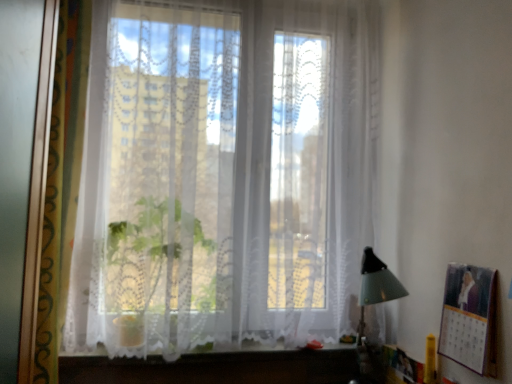
Question: Is metallic silver picture frame at right completely or partially inside transparent lace curtain at center?

Choices:
 (A) no
 (B) yes

Answer: (A)

Question: Is transparent lace curtain at center smaller than metallic silver picture frame at right?

Choices:
 (A) no
 (B) yes

Answer: (A)

Question: Is transparent lace curtain at center thinner than metallic silver picture frame at right?

Choices:
 (A) no
 (B) yes

Answer: (A)

Question: Can you confirm if transparent lace curtain at center is wider than metallic silver picture frame at right?

Choices:
 (A) no
 (B) yes

Answer: (B)

Question: From a real-world perspective, is transparent lace curtain at center positioned over metallic silver picture frame at right based on gravity?

Choices:
 (A) no
 (B) yes

Answer: (B)

Question: Considering the positions of transparent lace curtain at center and white lace vanity at lower center in the image, is transparent lace curtain at center bigger or smaller than white lace vanity at lower center?

Choices:
 (A) big
 (B) small

Answer: (A)

Question: Is point (121, 142) closer or farther from the camera than point (224, 365)?

Choices:
 (A) farther
 (B) closer

Answer: (B)

Question: Is transparent lace curtain at center taller or shorter than white lace vanity at lower center?

Choices:
 (A) short
 (B) tall

Answer: (B)

Question: From the image's perspective, is transparent lace curtain at center located above or below white lace vanity at lower center?

Choices:
 (A) above
 (B) below

Answer: (A)

Question: Considering the relative positions of metallic silver picture frame at right and white lace vanity at lower center in the image provided, is metallic silver picture frame at right to the left or to the right of white lace vanity at lower center?

Choices:
 (A) left
 (B) right

Answer: (B)

Question: From the image's perspective, relative to white lace vanity at lower center, is metallic silver picture frame at right above or below?

Choices:
 (A) above
 (B) below

Answer: (A)

Question: From their relative heights in the image, would you say metallic silver picture frame at right is taller or shorter than white lace vanity at lower center?

Choices:
 (A) short
 (B) tall

Answer: (B)

Question: Is metallic silver picture frame at right situated inside white lace vanity at lower center or outside?

Choices:
 (A) inside
 (B) outside

Answer: (B)

Question: From the image's perspective, is metallic silver picture frame at right positioned above or below transparent lace curtain at center?

Choices:
 (A) above
 (B) below

Answer: (B)

Question: In terms of width, does metallic silver picture frame at right look wider or thinner when compared to transparent lace curtain at center?

Choices:
 (A) wide
 (B) thin

Answer: (B)